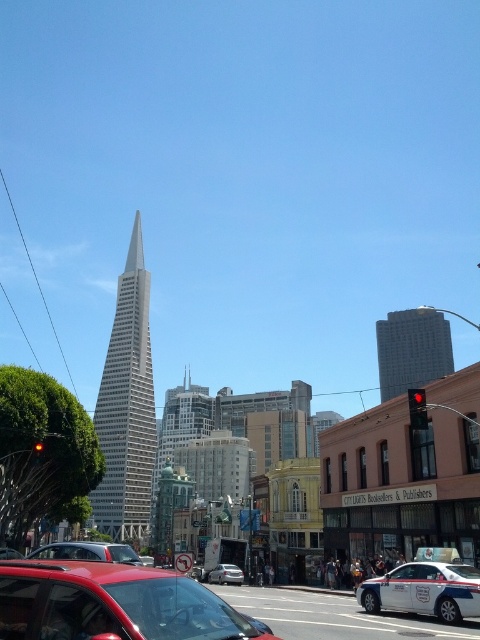
Question: Considering the real-world distances, which object is closest to the metallic silver sedan at center?

Choices:
 (A) white glossy police car at lower right
 (B) metallic red traffic light at center-right
 (C) matte red car at lower left

Answer: (B)

Question: Can you confirm if gray concrete skyscraper at right is thinner than shiny red car at center?

Choices:
 (A) no
 (B) yes

Answer: (A)

Question: Among these points, which one is farthest from the camera?

Choices:
 (A) (419, 401)
 (B) (431, 342)
 (C) (228, 577)
 (D) (36, 451)

Answer: (B)

Question: Does matte red car at lower left have a greater width compared to glass skyscraper at center?

Choices:
 (A) no
 (B) yes

Answer: (A)

Question: Does gray concrete skyscraper at right come behind red glass traffic light at left?

Choices:
 (A) yes
 (B) no

Answer: (A)

Question: Which object appears farthest from the camera in this image?

Choices:
 (A) red glass traffic light at left
 (B) gray concrete skyscraper at right

Answer: (B)